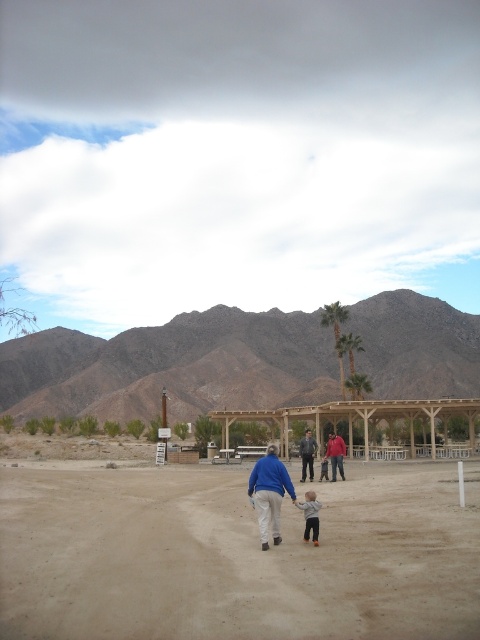
You are planning to take a photo of the wooden gazebo at center and the red cotton shirt at center. To ensure both are in the frame, should you adjust your camera angle upwards or downwards?

The wooden gazebo at center is located below the red cotton shirt at center, so you should adjust your camera angle upwards to capture both in the frame.

You are a hiker who wants to take shelter from the rain. You see the wooden gazebo at center and the leather jacket at center. Which one is closer to you?

The wooden gazebo at center is closer to you since it is positioned below the leather jacket at center, indicating it is lower in the visual hierarchy and thus nearer in the scene.